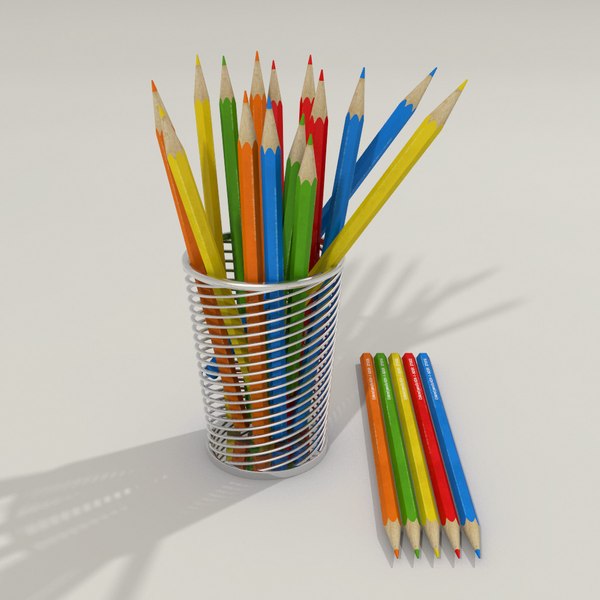
Image resolution: width=600 pixels, height=600 pixels. Identify the location of pencils lying on desk. (379, 434), (396, 441), (416, 444), (433, 448), (451, 454).